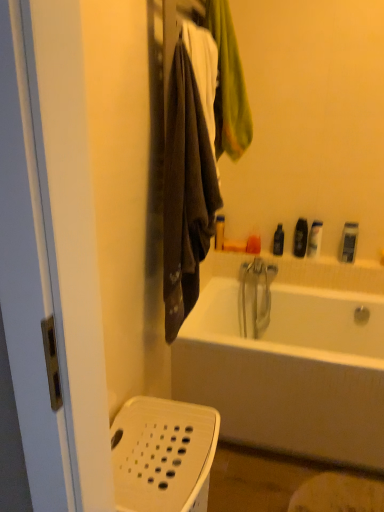
The height and width of the screenshot is (512, 384). What do you see at coordinates (163, 455) in the screenshot?
I see `white perforated basket at lower left` at bounding box center [163, 455].

What do you see at coordinates (278, 240) in the screenshot?
I see `black plastic bottle at upper right, which is the 4th toiletry in right-to-left order` at bounding box center [278, 240].

Image resolution: width=384 pixels, height=512 pixels. I want to click on orange matte soap at upper center, marked as the 5th toiletry in a right-to-left arrangement, so click(x=253, y=244).

Is the depth of dark brown fabric towel at left greater than that of orange matte soap at upper center, marked as the 5th toiletry in a right-to-left arrangement?

No, the depth of dark brown fabric towel at left is less than that of orange matte soap at upper center, marked as the 5th toiletry in a right-to-left arrangement.

From the image's perspective, is dark brown fabric towel at left located above or below orange matte soap at upper center, the 2th toiletry positioned from the left?

From the image's perspective, dark brown fabric towel at left appears above orange matte soap at upper center, the 2th toiletry positioned from the left.

Is dark brown fabric towel at left positioned far away from orange matte soap at upper center, marked as the 5th toiletry in a right-to-left arrangement?

Yes, dark brown fabric towel at left and orange matte soap at upper center, marked as the 5th toiletry in a right-to-left arrangement, are located far from each other.

From the image's perspective, count 4th toiletrys downward from the black plastic bottle at upper right, which is counted as the third toiletry, starting from the right, and point to it. Please provide its 2D coordinates.

[(253, 244)]

Considering the relative sizes of orange matte soap at upper center, marked as the 5th toiletry in a right-to-left arrangement, and black plastic bottle at upper right, which is counted as the third toiletry, starting from the right, in the image provided, is orange matte soap at upper center, marked as the 5th toiletry in a right-to-left arrangement, taller than black plastic bottle at upper right, which is counted as the third toiletry, starting from the right,?

Incorrect, the height of orange matte soap at upper center, marked as the 5th toiletry in a right-to-left arrangement, is not larger of that of black plastic bottle at upper right, which is counted as the third toiletry, starting from the right.

Is the position of orange matte soap at upper center, the 2th toiletry positioned from the left, less distant than that of black plastic bottle at upper right, marked as the fourth toiletry in a left-to-right arrangement?

No, the depth of orange matte soap at upper center, the 2th toiletry positioned from the left, is greater than that of black plastic bottle at upper right, marked as the fourth toiletry in a left-to-right arrangement.

Does matte plastic soap at upper center, positioned as the first toiletry in left-to-right order, appear on the right side of white perforated basket at lower left?

Yes, matte plastic soap at upper center, positioned as the first toiletry in left-to-right order, is to the right of white perforated basket at lower left.

Is matte plastic soap at upper center, acting as the 6th toiletry starting from the right, oriented towards white perforated basket at lower left?

Yes, matte plastic soap at upper center, acting as the 6th toiletry starting from the right, is turned towards white perforated basket at lower left.

Is matte plastic soap at upper center, acting as the 6th toiletry starting from the right, not near white perforated basket at lower left?

A: Yes.

Who is taller, matte plastic soap at upper center, positioned as the first toiletry in left-to-right order, or white perforated basket at lower left?

white perforated basket at lower left.

Locate an element on the screen. Image resolution: width=384 pixels, height=512 pixels. toiletry that is the 3rd object located above the white plastic razor at upper right, which is counted as the first toiletry, starting from the right (from the image's perspective) is located at coordinates (300, 238).

From a real-world perspective, is white plastic razor at upper right, the 6th toiletry when ordered from left to right, on black plastic bottle at upper right, which is counted as the third toiletry, starting from the right?

No, from a real-world perspective, white plastic razor at upper right, the 6th toiletry when ordered from left to right, is not over black plastic bottle at upper right, which is counted as the third toiletry, starting from the right

Does white plastic razor at upper right, the 6th toiletry when ordered from left to right, have a greater width compared to black plastic bottle at upper right, which is counted as the third toiletry, starting from the right?

Correct, the width of white plastic razor at upper right, the 6th toiletry when ordered from left to right, exceeds that of black plastic bottle at upper right, which is counted as the third toiletry, starting from the right.

Consider the image. Is white plastic razor at upper right, the 6th toiletry when ordered from left to right, not inside black plastic bottle at upper right, which is counted as the third toiletry, starting from the right?

Absolutely, white plastic razor at upper right, the 6th toiletry when ordered from left to right, is external to black plastic bottle at upper right, which is counted as the third toiletry, starting from the right.

Is matte plastic soap at upper center, acting as the 6th toiletry starting from the right, touching black plastic bottle at upper right, marked as the fourth toiletry in a left-to-right arrangement?

No, matte plastic soap at upper center, acting as the 6th toiletry starting from the right, is not in contact with black plastic bottle at upper right, marked as the fourth toiletry in a left-to-right arrangement.

From a real-world perspective, between matte plastic soap at upper center, positioned as the first toiletry in left-to-right order, and black plastic bottle at upper right, marked as the fourth toiletry in a left-to-right arrangement, who is vertically lower?

matte plastic soap at upper center, positioned as the first toiletry in left-to-right order.

Where is `the 3rd toiletry behind the black plastic bottle at upper right, which is counted as the third toiletry, starting from the right`? the 3rd toiletry behind the black plastic bottle at upper right, which is counted as the third toiletry, starting from the right is located at coordinates (219, 232).

Which is more to the left, matte plastic soap at upper center, acting as the 6th toiletry starting from the right, or black plastic bottle at upper right, which is counted as the third toiletry, starting from the right?

From the viewer's perspective, matte plastic soap at upper center, acting as the 6th toiletry starting from the right, appears more on the left side.

Which of these two, matte plastic soap at upper center, positioned as the first toiletry in left-to-right order, or orange matte soap at upper center, marked as the 5th toiletry in a right-to-left arrangement, is smaller?

Smaller between the two is orange matte soap at upper center, marked as the 5th toiletry in a right-to-left arrangement.

The image size is (384, 512). In order to click on toiletry that appears on the left of orange matte soap at upper center, the 2th toiletry positioned from the left in this screenshot , I will do `click(219, 232)`.

Is point (215, 237) behind point (254, 250)?

That is True.

Considering the positions of objects matte plastic soap at upper center, positioned as the first toiletry in left-to-right order, and orange matte soap at upper center, marked as the 5th toiletry in a right-to-left arrangement, in the image provided, who is in front, matte plastic soap at upper center, positioned as the first toiletry in left-to-right order, or orange matte soap at upper center, marked as the 5th toiletry in a right-to-left arrangement,?

orange matte soap at upper center, marked as the 5th toiletry in a right-to-left arrangement, is closer to the camera.

Based on their sizes in the image, would you say dark brown fabric towel at left is bigger or smaller than white perforated basket at lower left?

dark brown fabric towel at left is bigger than white perforated basket at lower left.

Can you see dark brown fabric towel at left touching white perforated basket at lower left?

No, dark brown fabric towel at left is not making contact with white perforated basket at lower left.

What's the angular difference between dark brown fabric towel at left and white perforated basket at lower left's facing directions?

The angular difference between dark brown fabric towel at left and white perforated basket at lower left is 0.95 degrees.

From the image's perspective, which object appears higher, dark brown fabric towel at left or white perforated basket at lower left?

dark brown fabric towel at left, from the image's perspective.

Find the location of a particular element. the 6th toiletry below the dark brown fabric towel at left (from the image's perspective) is located at coordinates (253, 244).

There is a orange matte soap at upper center, marked as the 5th toiletry in a right-to-left arrangement. In order to click on the 4th toiletry above it (from the image's perspective) in this screenshot , I will do `click(300, 238)`.

When comparing their distances from black plastic bottle at upper right, the 3th toiletry in the left-to-right sequence, does black plastic bottle at upper right, marked as the fourth toiletry in a left-to-right arrangement, or translucent plastic bottle at upper right, the fifth toiletry in the left-to-right sequence, seem closer?

black plastic bottle at upper right, marked as the fourth toiletry in a left-to-right arrangement, lies closer to black plastic bottle at upper right, the 3th toiletry in the left-to-right sequence, than the other object.

When comparing their distances from translucent plastic bottle at upper right, placed as the 2th toiletry when sorted from right to left, does black plastic bottle at upper right, which is counted as the third toiletry, starting from the right, or matte plastic soap at upper center, acting as the 6th toiletry starting from the right, seem closer?

The object closer to translucent plastic bottle at upper right, placed as the 2th toiletry when sorted from right to left, is black plastic bottle at upper right, which is counted as the third toiletry, starting from the right.

Looking at the image, which one is located further to dark brown fabric towel at left, matte plastic soap at upper center, positioned as the first toiletry in left-to-right order, or black plastic bottle at upper right, marked as the fourth toiletry in a left-to-right arrangement?

The object further to dark brown fabric towel at left is black plastic bottle at upper right, marked as the fourth toiletry in a left-to-right arrangement.

Looking at the image, which one is located closer to translucent plastic bottle at upper right, the fifth toiletry in the left-to-right sequence, orange matte soap at upper center, the 2th toiletry positioned from the left, or dark brown fabric towel at left?

orange matte soap at upper center, the 2th toiletry positioned from the left, is closer to translucent plastic bottle at upper right, the fifth toiletry in the left-to-right sequence.

Looking at the image, which one is located further to translucent plastic bottle at upper right, placed as the 2th toiletry when sorted from right to left, white perforated basket at lower left or matte plastic soap at upper center, positioned as the first toiletry in left-to-right order?

Among the two, white perforated basket at lower left is located further to translucent plastic bottle at upper right, placed as the 2th toiletry when sorted from right to left.

Considering their positions, is black plastic bottle at upper right, marked as the fourth toiletry in a left-to-right arrangement, positioned closer to matte plastic soap at upper center, acting as the 6th toiletry starting from the right, than orange matte soap at upper center, marked as the 5th toiletry in a right-to-left arrangement?

Based on the image, orange matte soap at upper center, marked as the 5th toiletry in a right-to-left arrangement, appears to be nearer to matte plastic soap at upper center, acting as the 6th toiletry starting from the right.

Considering their positions, is dark brown fabric towel at left positioned further to white plastic razor at upper right, the 6th toiletry when ordered from left to right, than white perforated basket at lower left?

white perforated basket at lower left is positioned further to the anchor white plastic razor at upper right, the 6th toiletry when ordered from left to right.

Consider the image. Which object lies nearer to the anchor point black plastic bottle at upper right, the 3th toiletry in the left-to-right sequence, white perforated basket at lower left or black plastic bottle at upper right, which is counted as the third toiletry, starting from the right?

black plastic bottle at upper right, which is counted as the third toiletry, starting from the right.

Image resolution: width=384 pixels, height=512 pixels. Find the location of `toiletry between dark brown fabric towel at left and translucent plastic bottle at upper right, placed as the 2th toiletry when sorted from right to left, in the front-back direction`. toiletry between dark brown fabric towel at left and translucent plastic bottle at upper right, placed as the 2th toiletry when sorted from right to left, in the front-back direction is located at coordinates (349, 242).

Locate an element on the screen. The width and height of the screenshot is (384, 512). towel/napkin located between white perforated basket at lower left and black plastic bottle at upper right, which is the 4th toiletry in right-to-left order, in the depth direction is located at coordinates (186, 193).

Where is `towel/napkin between white perforated basket at lower left and black plastic bottle at upper right, marked as the fourth toiletry in a left-to-right arrangement, in the front-back direction`? The height and width of the screenshot is (512, 384). towel/napkin between white perforated basket at lower left and black plastic bottle at upper right, marked as the fourth toiletry in a left-to-right arrangement, in the front-back direction is located at coordinates (186, 193).

Identify the location of towel/napkin located between white perforated basket at lower left and orange matte soap at upper center, marked as the 5th toiletry in a right-to-left arrangement, in the depth direction. Image resolution: width=384 pixels, height=512 pixels. (186, 193).